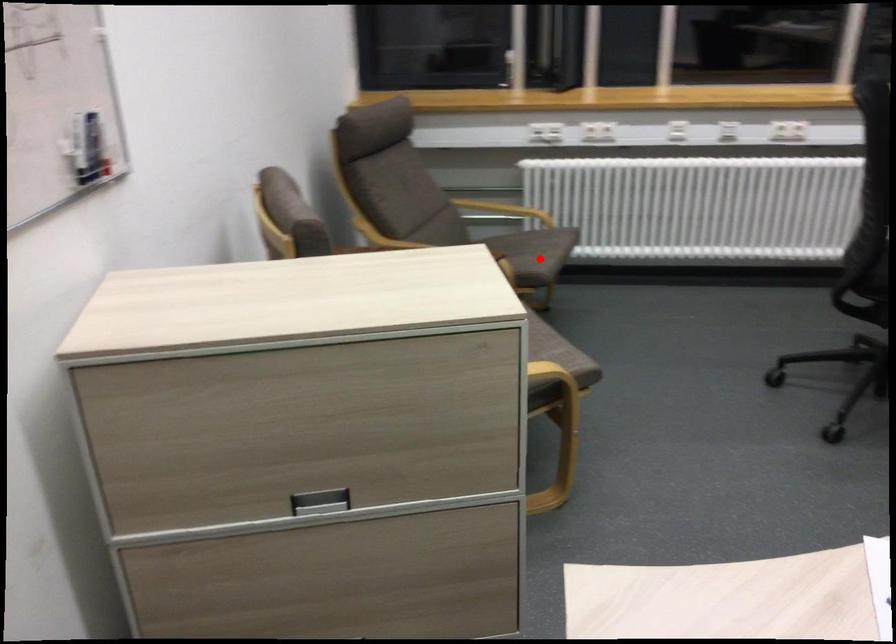
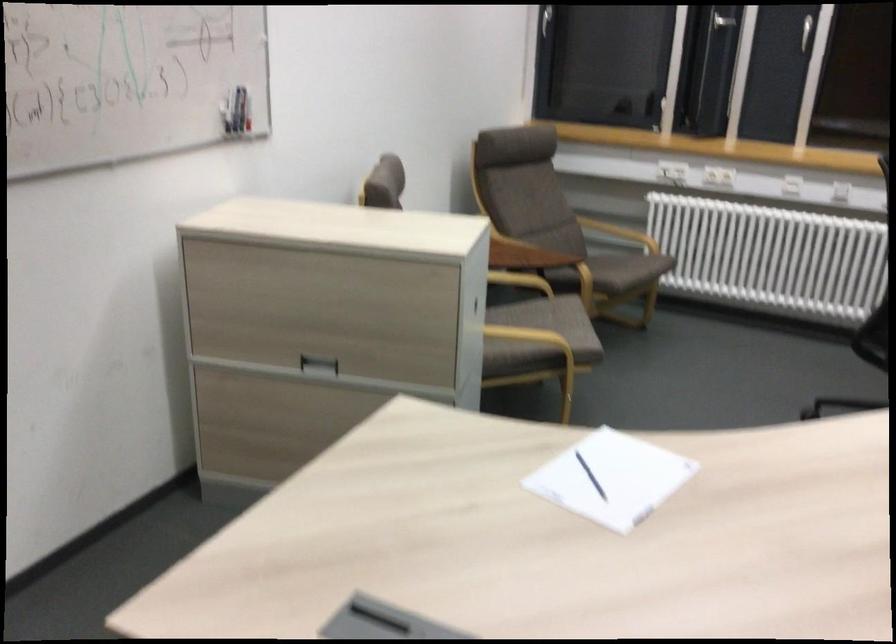
Question: I am providing you with two images of the same scene from different viewpoints. In image1, a red point is highlighted. Considering the same 3D point in image2, which of the following is correct?

Choices:
 (A) It is closer
 (B) It is farther

Answer: (B)